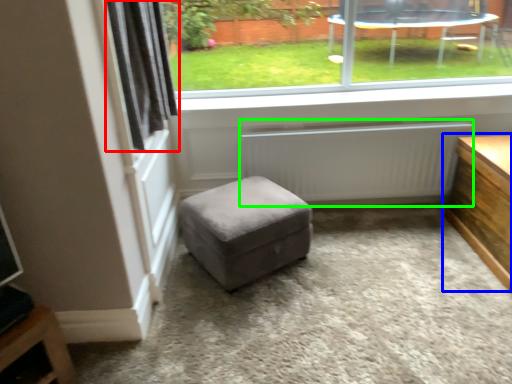
Question: Which object is the closest to the curtain (highlighted by a red box)? Choose among these: table (highlighted by a blue box) or radiator (highlighted by a green box).

Choices:
 (A) table
 (B) radiator

Answer: (B)